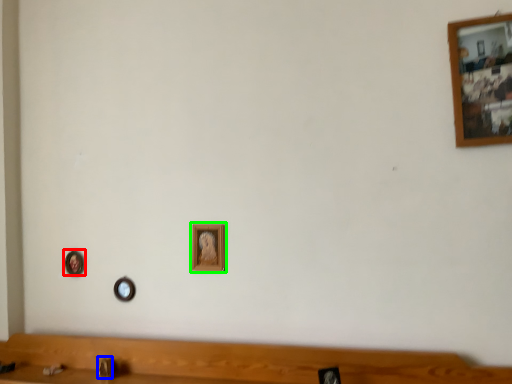
Question: Estimate the real-world distances between objects in this image. Which object is closer to picture frame (highlighted by a red box), faucet (highlighted by a blue box) or picture frame (highlighted by a green box)?

Choices:
 (A) faucet
 (B) picture frame

Answer: (A)